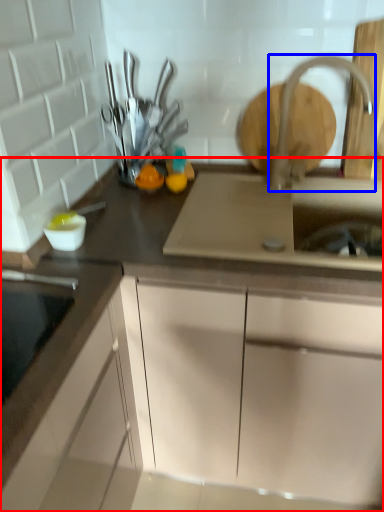
Question: Which point is further to the camera, cabinetry (highlighted by a red box) or tap (highlighted by a blue box)?

Choices:
 (A) cabinetry
 (B) tap

Answer: (B)